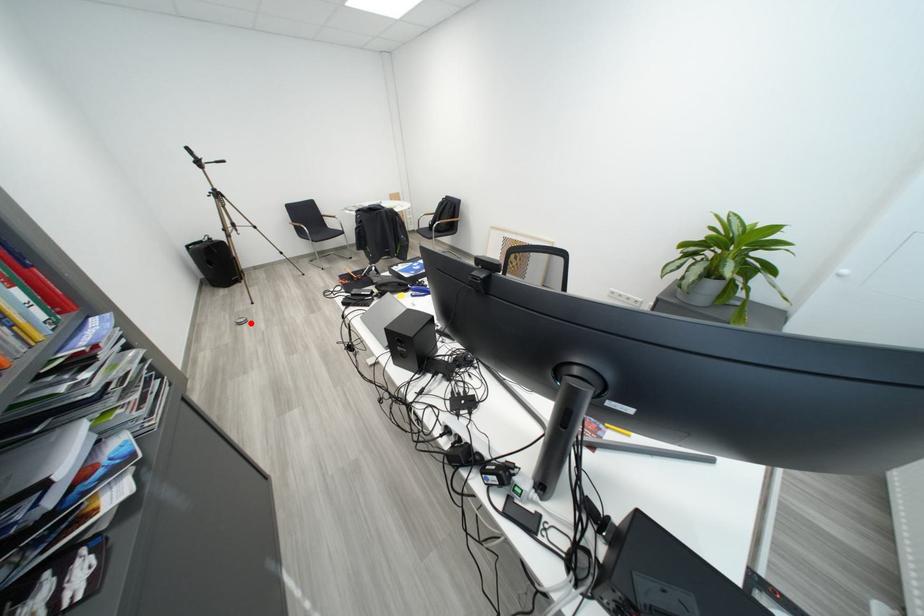
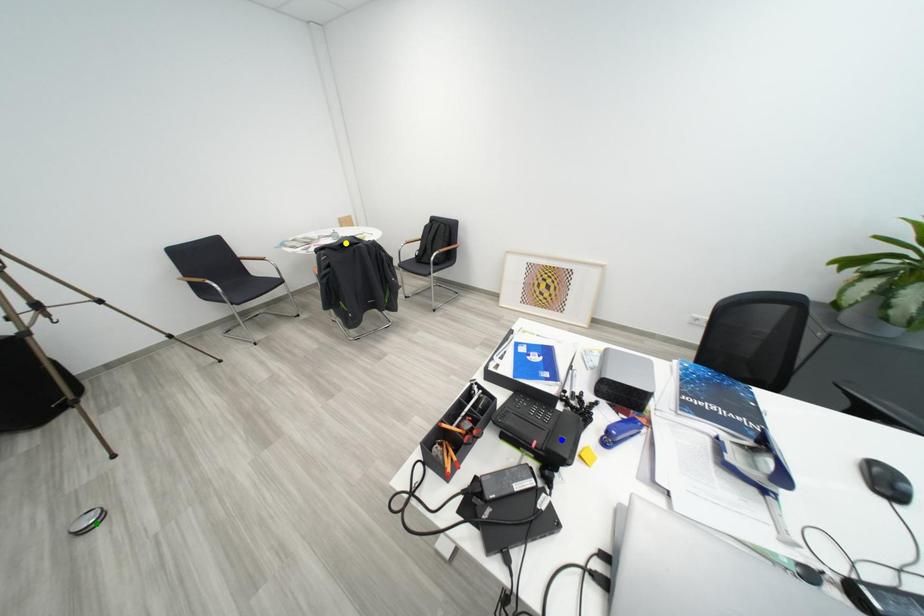
Question: I am providing you with two images of the same scene from different viewpoints. A red point is marked on the first image. You are given multiple points on the second image. Which point in image 2 represents the same 3d spot as the red point in image 1?

Choices:
 (A) green point
 (B) yellow point
 (C) blue point

Answer: (A)